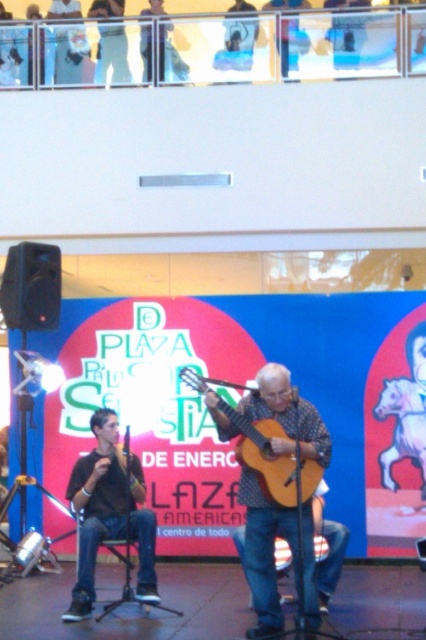
How much distance is there between matte black microphone at lower left and acoustic wood guitar at center?

1.48 meters

Consider the image. Which is more to the right, matte black microphone at lower left or acoustic wood guitar at center?

From the viewer's perspective, acoustic wood guitar at center appears more on the right side.

Is point (141, 570) positioned before point (264, 436)?

No, it is not.

The height and width of the screenshot is (640, 426). I want to click on matte black microphone at lower left, so click(109, 513).

Does acoustic guitar at center appear over acoustic wood guitar at center?

Actually, acoustic guitar at center is below acoustic wood guitar at center.

Which is below, acoustic guitar at center or acoustic wood guitar at center?

acoustic guitar at center is below.

Is point (278, 408) closer to viewer compared to point (293, 492)?

No, (278, 408) is behind (293, 492).

Find the location of a particular element. acoustic guitar at center is located at coordinates (264, 552).

Is acoustic guitar at center taller than matte black microphone at lower left?

In fact, acoustic guitar at center may be shorter than matte black microphone at lower left.

Between acoustic guitar at center and matte black microphone at lower left, which one is positioned lower?

Positioned lower is acoustic guitar at center.

Locate an element on the screen. This screenshot has width=426, height=640. acoustic guitar at center is located at coordinates (264, 552).